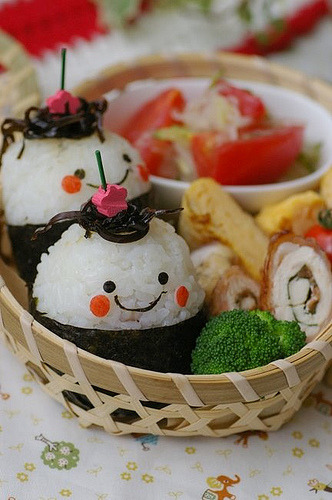
This screenshot has height=500, width=332. What are the coordinates of `table` in the screenshot? It's located at (107, 471).